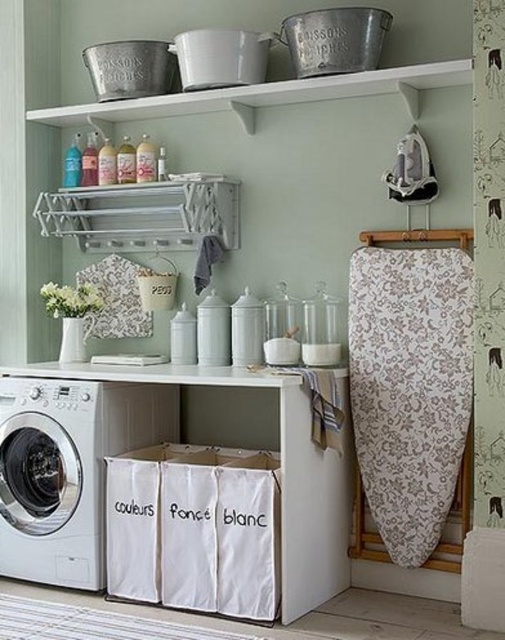
You are organizing laundry in the room and need to place a new basket between the white fabric laundry basket at lower center and the white matte washing machine at lower left. Based on their positions, where should you place the new basket to ensure it is between them?

Place the new basket to the left of the white fabric laundry basket at lower center and to the right of the white matte washing machine at lower left, since the white fabric laundry basket at lower center is already to the right of the white matte washing machine at lower left.